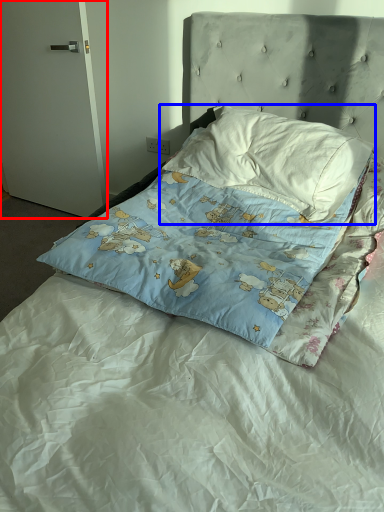
Question: Which object appears farthest to the camera in this image, door (highlighted by a red box) or pillow (highlighted by a blue box)?

Choices:
 (A) door
 (B) pillow

Answer: (A)